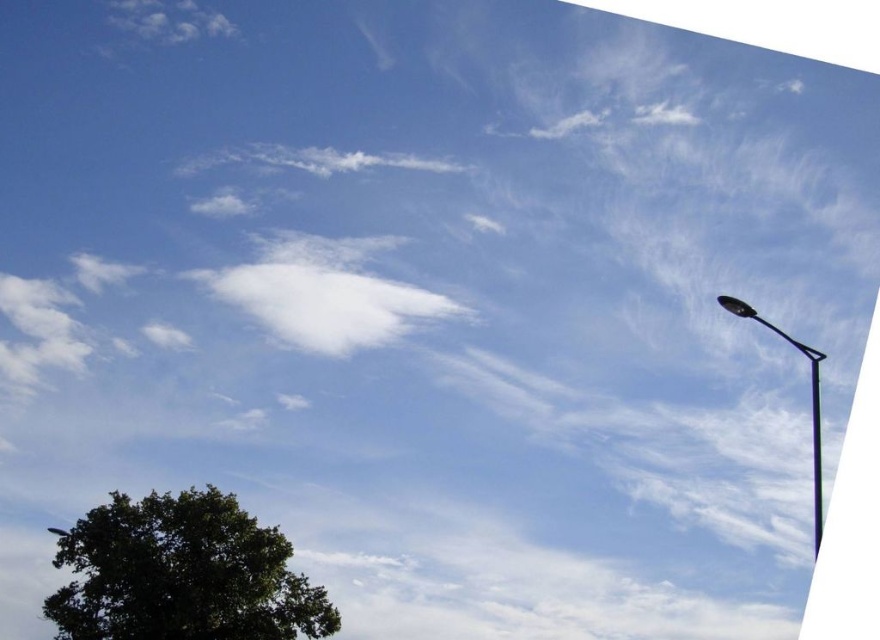
Between point (100, 628) and point (818, 394), which one is positioned behind?

Positioned behind is point (100, 628).

Describe the element at coordinates (182, 573) in the screenshot. I see `green leafy tree at lower left` at that location.

Who is more distant from viewer, (292, 605) or (818, 403)?

Positioned behind is point (292, 605).

The image size is (880, 640). I want to click on green leafy tree at lower left, so click(182, 573).